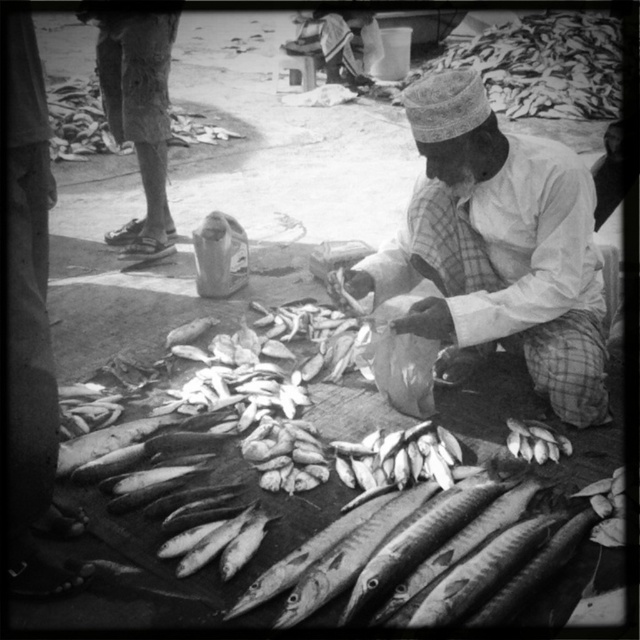
Question: Among these objects, which one is farthest from the camera?

Choices:
 (A) smooth silver fish at lower right
 (B) smooth silver fish at center
 (C) white cotton shirt at center

Answer: (A)

Question: Among these points, which one is nearest to the camera?

Choices:
 (A) (564, 442)
 (B) (500, 529)
 (C) (456, 177)

Answer: (B)

Question: Can you confirm if white cotton shirt at center is positioned above smooth silver fish at lower right?

Choices:
 (A) yes
 (B) no

Answer: (A)

Question: Can you confirm if white cotton shirt at center is bigger than smooth silver fish at lower right?

Choices:
 (A) no
 (B) yes

Answer: (B)

Question: Is smooth silver fish at center positioned in front of white cotton shirt at center?

Choices:
 (A) no
 (B) yes

Answer: (B)

Question: Which point is farther to the camera?

Choices:
 (A) white cotton shirt at center
 (B) smooth silver fish at lower right
 (C) smooth silver fish at center

Answer: (B)